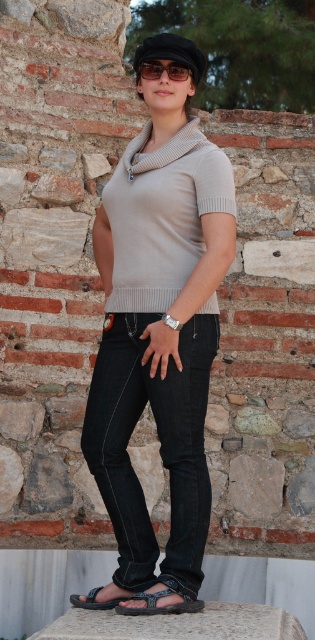
Between dark blue denim jeans at center and black textured sandal at lower center, which one has more height?

dark blue denim jeans at center

At what (x,y) coordinates should I click in order to perform the action: click on dark blue denim jeans at center. Please return your answer as a coordinate pair (x, y). Looking at the image, I should click on (160, 445).

Who is higher up, beige knitted sweater at center or black leather sandal at lower center?

beige knitted sweater at center is higher up.

Where is `beige knitted sweater at center`? The width and height of the screenshot is (315, 640). beige knitted sweater at center is located at coordinates (162, 216).

Find the location of a particular element. dark blue denim jeans at center is located at coordinates 160,445.

Looking at this image, does dark blue denim jeans at center appear on the left side of black matte sunglasses at center?

Indeed, dark blue denim jeans at center is positioned on the left side of black matte sunglasses at center.

Is point (195, 470) behind point (144, 72)?

No.

Image resolution: width=315 pixels, height=640 pixels. I want to click on dark blue denim jeans at center, so click(x=160, y=445).